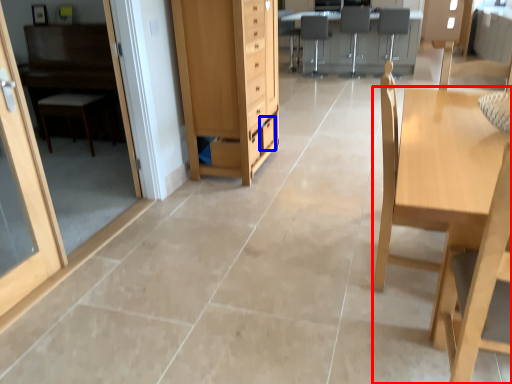
Question: Which object is further to the camera taking this photo, table (highlighted by a red box) or drawer (highlighted by a blue box)?

Choices:
 (A) table
 (B) drawer

Answer: (B)